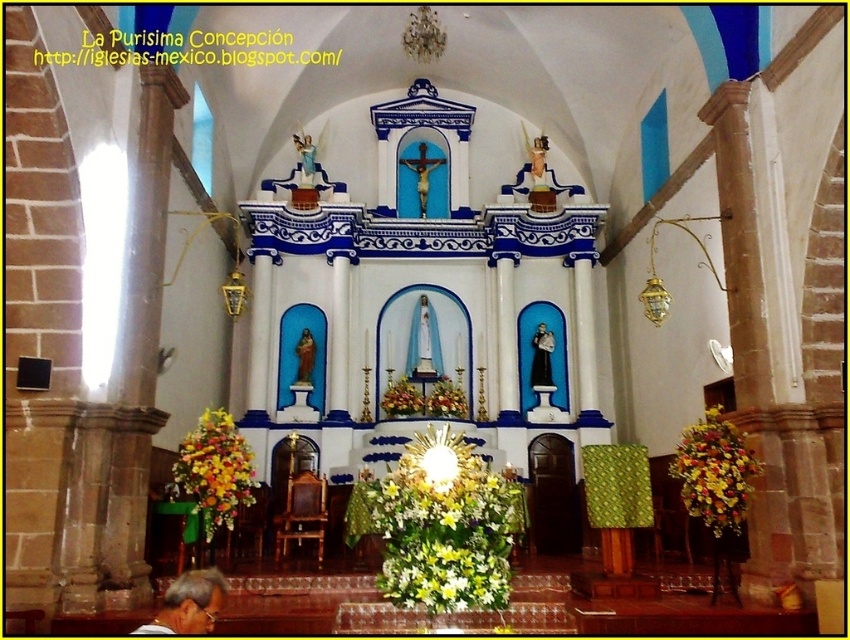
Question: Is yellow-green floral bouquet at center further to the viewer compared to yellow fabric floral arrangement at lower left?

Choices:
 (A) yes
 (B) no

Answer: (B)

Question: Which object is farther from the camera taking this photo?

Choices:
 (A) yellow fabric floral arrangement at right
 (B) yellow fabric floral arrangement at lower left
 (C) yellow-green floral bouquet at center

Answer: (B)

Question: Among these points, which one is nearest to the camera?

Choices:
 (A) (707, 452)
 (B) (241, 442)
 (C) (494, 605)

Answer: (C)

Question: Is yellow-green floral bouquet at center to the right of yellow fabric floral arrangement at right from the viewer's perspective?

Choices:
 (A) no
 (B) yes

Answer: (A)

Question: In this image, where is yellow fabric floral arrangement at right located relative to yellow fabric floral arrangement at lower left?

Choices:
 (A) below
 (B) above

Answer: (A)

Question: Which point appears closest to the camera in this image?

Choices:
 (A) (709, 416)
 (B) (211, 481)
 (C) (435, 502)

Answer: (C)